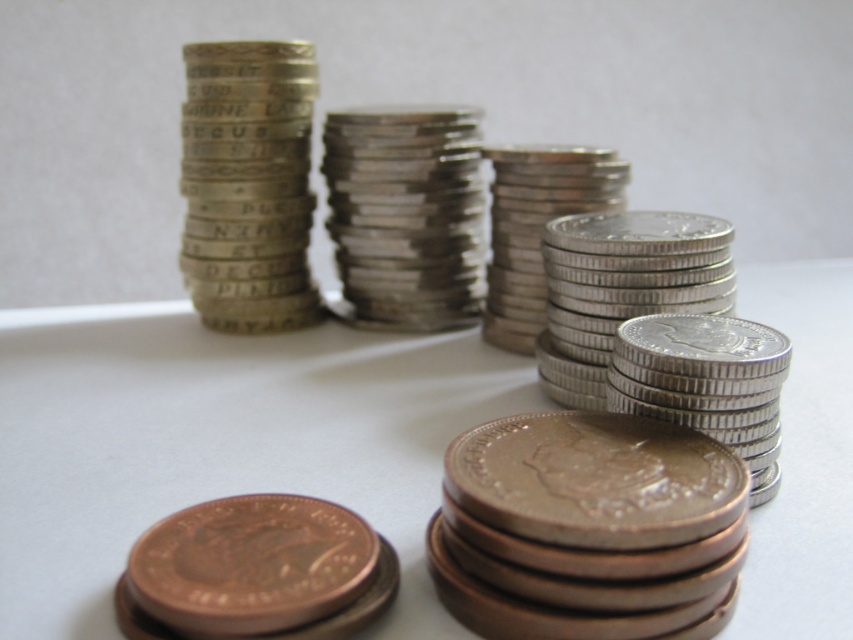
You are an assistant organizing coins. You have a bronze metallic coin at lower center and silver metallic coins at center. Which stack is shorter?

The bronze metallic coin at lower center is shorter than the silver metallic coins at center.

You are standing in front of the image and want to describe the position of the shiny metallic coins at center. What are their coordinates?

The shiny metallic coins at center are located at coordinates point (219, 442).